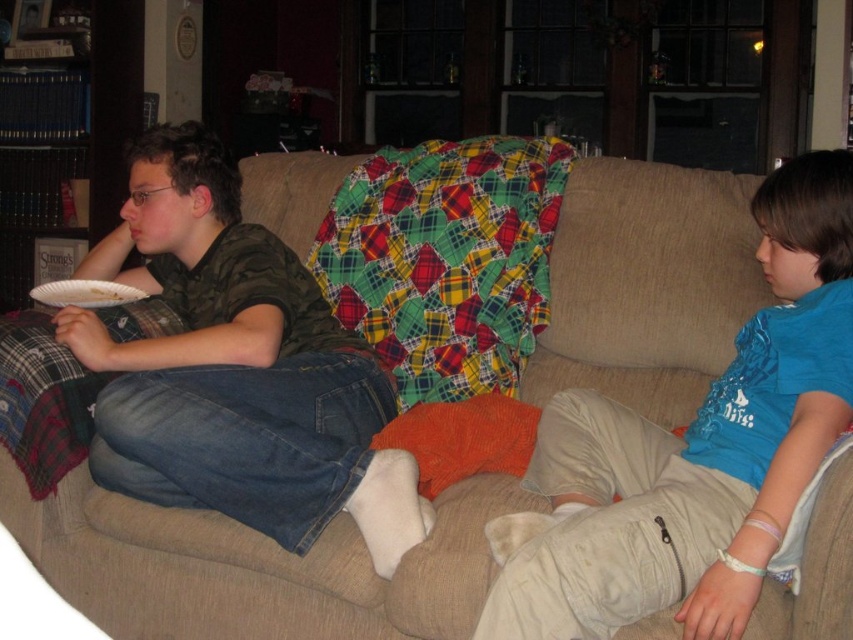
Can you confirm if blue cotton shirt at right is positioned to the right of matte green shirt at left?

Indeed, blue cotton shirt at right is positioned on the right side of matte green shirt at left.

Does point (619, 620) come in front of point (218, 205)?

Yes, point (619, 620) is closer to viewer.

This screenshot has height=640, width=853. What are the coordinates of `blue cotton shirt at right` in the screenshot? It's located at (693, 452).

Which is in front, point (788, 401) or point (120, 304)?

Point (788, 401)

Is blue cotton shirt at right taller than white paper plate at left?

Yes.

The image size is (853, 640). Identify the location of blue cotton shirt at right. (693, 452).

Does point (374, 477) come farther from viewer compared to point (129, 296)?

No, (374, 477) is closer to viewer.

Can you confirm if matte green shirt at left is wider than white paper plate at left?

Correct, the width of matte green shirt at left exceeds that of white paper plate at left.

Who is more forward, (x=256, y=502) or (x=96, y=285)?

Point (x=256, y=502)

You are a GUI agent. You are given a task and a screenshot of the screen. Output one action in this format:
    pyautogui.click(x=<x>, y=<y>)
    Task: Click on the matte green shirt at left
    The height and width of the screenshot is (640, 853).
    Given the screenshot: What is the action you would take?
    pyautogui.click(x=236, y=369)